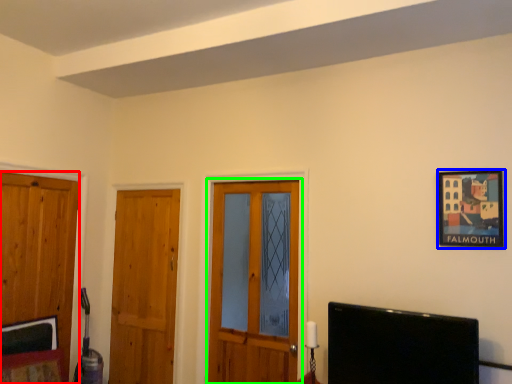
Question: Considering the real-world distances, which object is closest to door (highlighted by a red box)? picture frame (highlighted by a blue box) or door (highlighted by a green box).

Choices:
 (A) picture frame
 (B) door

Answer: (B)